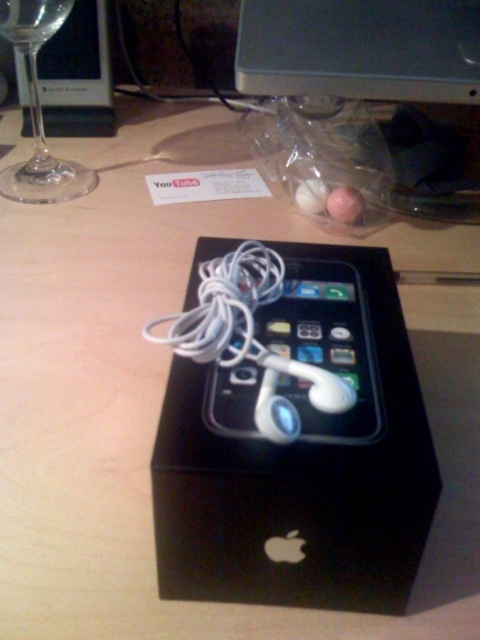
You are packing a gift box and need to ensure the white glossy earphones at center fit inside the black matte box at center. Based on the scene, can the earphones fit inside the box?

The black matte box at center is wider than the white glossy earphones at center, so the earphones should fit inside the box as long as their other dimensions also accommodate.

You are setting up a gift table and need to arrange items as shown. The white glossy earphones at center and transparent glass at left must be placed on the table. According to the image, which item should be positioned to the left of the other?

The transparent glass at left should be positioned to the left of the white glossy earphones at center because the white glossy earphones at center are to the right of the transparent glass at left in the image.